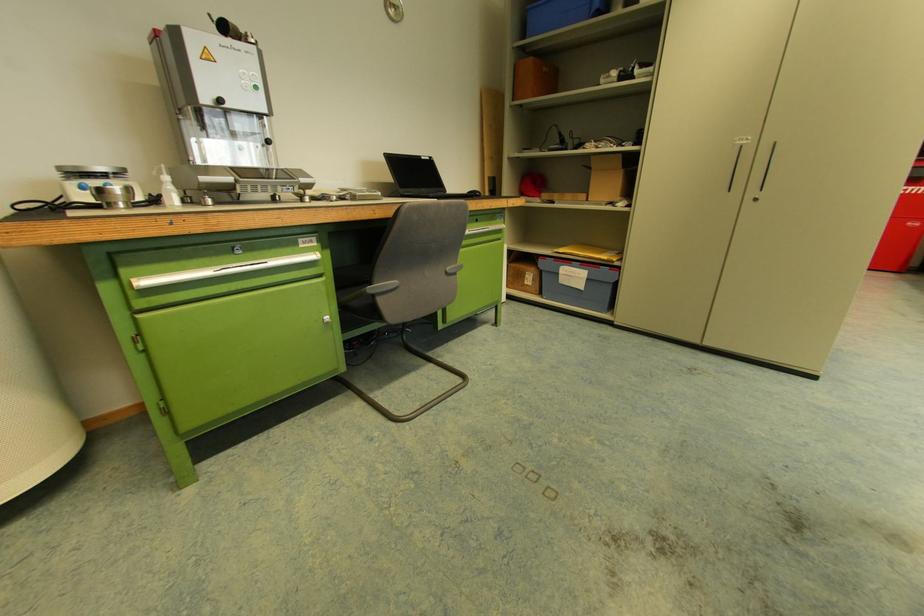
Where would you sit the chair sitting surface? Please return your answer as a coordinate pair (x, y).

(374, 284)